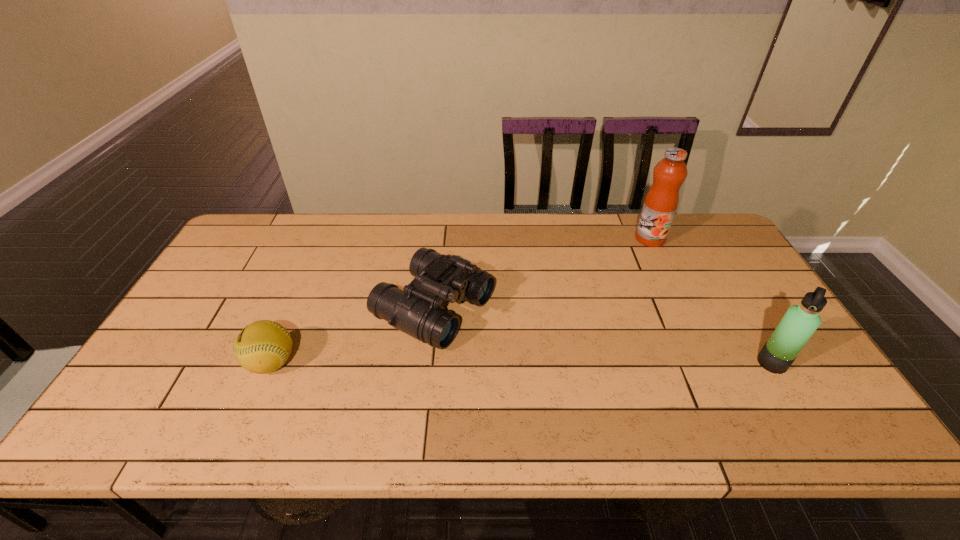
Image resolution: width=960 pixels, height=540 pixels. In order to click on vacant area that lies between the softball and the third tallest object in this screenshot , I will do tap(353, 335).

Where is `vacant point located between the second shortest object and the third shortest object`? Image resolution: width=960 pixels, height=540 pixels. vacant point located between the second shortest object and the third shortest object is located at coordinates (603, 335).

Image resolution: width=960 pixels, height=540 pixels. In order to click on vacant area that lies between the farthest object and the thermos bottle in this screenshot , I will do `click(711, 301)`.

Image resolution: width=960 pixels, height=540 pixels. Identify the location of free point between the third tallest object and the farthest object. (542, 273).

I want to click on free space between the fruit juice and the second tallest object, so [x=711, y=301].

This screenshot has width=960, height=540. Find the location of `object that is the second closest to the tallest object`. object that is the second closest to the tallest object is located at coordinates (417, 311).

Locate which object is the third closest to the farthest object. Please provide its 2D coordinates. Your answer should be formatted as a tuple, i.e. [(x, y)], where the tuple contains the x and y coordinates of a point satisfying the conditions above.

[(262, 347)]

Locate an element on the screen. vacant area that satisfies the following two spatial constraints: 1. on the front side of the third tallest object; 2. on the left side of the second tallest object is located at coordinates (428, 363).

I want to click on blank space that satisfies the following two spatial constraints: 1. on the back side of the third object from right to left; 2. on the right side of the third object from left to right, so (x=442, y=239).

Where is `free space that satisfies the following two spatial constraints: 1. on the back side of the third object from left to right; 2. on the left side of the third object from right to left`? free space that satisfies the following two spatial constraints: 1. on the back side of the third object from left to right; 2. on the left side of the third object from right to left is located at coordinates (442, 239).